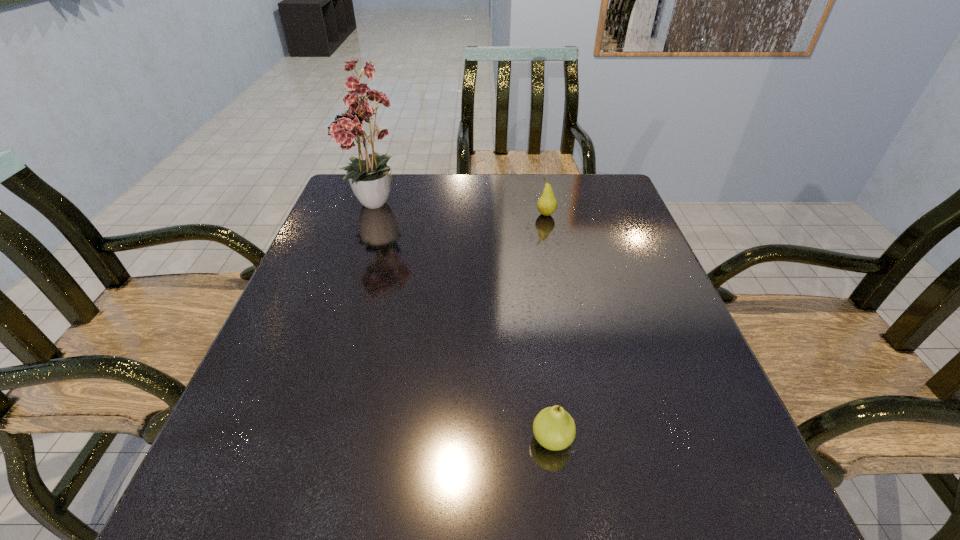
This screenshot has width=960, height=540. Find the location of `pear located in the far edge section of the desktop`. pear located in the far edge section of the desktop is located at coordinates (x=547, y=204).

I want to click on object present at the left edge, so click(372, 180).

Locate an element on the screen. object at the far left corner is located at coordinates (372, 180).

The height and width of the screenshot is (540, 960). What are the coordinates of `free space at the far edge of the desktop` in the screenshot? It's located at (488, 176).

In the image, there is a desktop. In order to click on free region at the near edge in this screenshot , I will do `click(331, 498)`.

You are a GUI agent. You are given a task and a screenshot of the screen. Output one action in this format:
    pyautogui.click(x=<x>, y=<y>)
    Task: Click on the free space at the left edge of the desktop
    The image size is (960, 540).
    Given the screenshot: What is the action you would take?
    pyautogui.click(x=260, y=404)

This screenshot has height=540, width=960. Find the location of `free space at the right edge of the desktop`. free space at the right edge of the desktop is located at coordinates (622, 244).

The image size is (960, 540). In the image, there is a desktop. What are the coordinates of `free region at the far left corner` in the screenshot? It's located at (348, 188).

Image resolution: width=960 pixels, height=540 pixels. What are the coordinates of `free space at the near left corner of the desktop` in the screenshot? It's located at (257, 502).

At what (x,y) coordinates should I click in order to perform the action: click on vacant space at the far right corner of the desktop. Please return your answer as a coordinate pair (x, y). The height and width of the screenshot is (540, 960). Looking at the image, I should click on point(586,173).